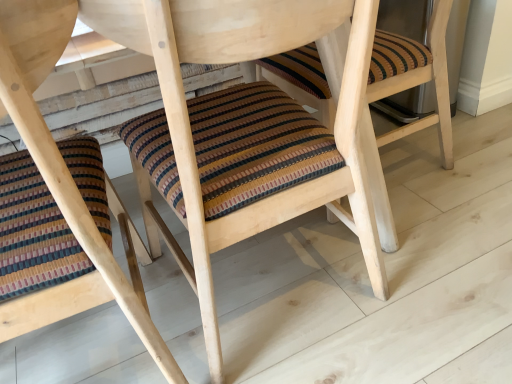
The height and width of the screenshot is (384, 512). I want to click on striped fabric cushion at center, the 2th chair when ordered from left to right, so click(x=246, y=127).

What do you see at coordinates (246, 127) in the screenshot?
I see `striped fabric cushion at center, which is counted as the 1th chair, starting from the right` at bounding box center [246, 127].

The image size is (512, 384). Find the location of `striped fabric cushion at lower left, acting as the 2th chair starting from the right`. striped fabric cushion at lower left, acting as the 2th chair starting from the right is located at coordinates 62,170.

Describe the element at coordinates (62, 170) in the screenshot. I see `striped fabric cushion at lower left, positioned as the 1th chair in left-to-right order` at that location.

How much space does striped fabric cushion at lower left, positioned as the 1th chair in left-to-right order, occupy vertically?

It is 33.05 inches.

The height and width of the screenshot is (384, 512). Identify the location of striped fabric cushion at center, the 2th chair when ordered from left to right. (246, 127).

Between striped fabric cushion at center, which is counted as the 1th chair, starting from the right, and striped fabric cushion at lower left, acting as the 2th chair starting from the right, which one appears on the right side from the viewer's perspective?

Positioned to the right is striped fabric cushion at center, which is counted as the 1th chair, starting from the right.

Is striped fabric cushion at center, which is counted as the 1th chair, starting from the right, positioned in front of striped fabric cushion at lower left, acting as the 2th chair starting from the right?

No, striped fabric cushion at center, which is counted as the 1th chair, starting from the right, is behind striped fabric cushion at lower left, acting as the 2th chair starting from the right.

Is point (290, 183) in front of point (163, 373)?

No, (290, 183) is further to viewer.

From the image's perspective, between striped fabric cushion at center, the 2th chair when ordered from left to right, and striped fabric cushion at lower left, acting as the 2th chair starting from the right, who is located below?

striped fabric cushion at lower left, acting as the 2th chair starting from the right, is shown below in the image.

From a real-world perspective, is striped fabric cushion at center, the 2th chair when ordered from left to right, positioned above or below striped fabric cushion at lower left, acting as the 2th chair starting from the right?

In terms of real-world spatial position, striped fabric cushion at center, the 2th chair when ordered from left to right, is below striped fabric cushion at lower left, acting as the 2th chair starting from the right.

In the scene shown: Considering the sizes of striped fabric cushion at center, which is counted as the 1th chair, starting from the right, and striped fabric cushion at lower left, positioned as the 1th chair in left-to-right order, in the image, is striped fabric cushion at center, which is counted as the 1th chair, starting from the right, wider or thinner than striped fabric cushion at lower left, positioned as the 1th chair in left-to-right order,?

striped fabric cushion at center, which is counted as the 1th chair, starting from the right, is thinner than striped fabric cushion at lower left, positioned as the 1th chair in left-to-right order.

Which of these two, striped fabric cushion at center, the 2th chair when ordered from left to right, or striped fabric cushion at lower left, acting as the 2th chair starting from the right, stands shorter?

striped fabric cushion at center, the 2th chair when ordered from left to right, is shorter.

Between striped fabric cushion at center, the 2th chair when ordered from left to right, and striped fabric cushion at lower left, positioned as the 1th chair in left-to-right order, which one has smaller size?

striped fabric cushion at lower left, positioned as the 1th chair in left-to-right order, is smaller.

Is striped fabric cushion at center, the 2th chair when ordered from left to right, not inside striped fabric cushion at lower left, acting as the 2th chair starting from the right?

Absolutely, striped fabric cushion at center, the 2th chair when ordered from left to right, is external to striped fabric cushion at lower left, acting as the 2th chair starting from the right.

Would you say striped fabric cushion at center, the 2th chair when ordered from left to right, is a long distance from striped fabric cushion at lower left, positioned as the 1th chair in left-to-right order?

No, striped fabric cushion at center, the 2th chair when ordered from left to right, is not far from striped fabric cushion at lower left, positioned as the 1th chair in left-to-right order.

In the scene shown: Is striped fabric cushion at center, which is counted as the 1th chair, starting from the right, oriented towards striped fabric cushion at lower left, positioned as the 1th chair in left-to-right order?

No.

Consider the image. How many degrees apart are the facing directions of striped fabric cushion at center, the 2th chair when ordered from left to right, and striped fabric cushion at lower left, acting as the 2th chair starting from the right?

The facing directions of striped fabric cushion at center, the 2th chair when ordered from left to right, and striped fabric cushion at lower left, acting as the 2th chair starting from the right, are 0.257 degrees apart.

How far apart are striped fabric cushion at center, which is counted as the 1th chair, starting from the right, and striped fabric cushion at lower left, acting as the 2th chair starting from the right?

striped fabric cushion at center, which is counted as the 1th chair, starting from the right, and striped fabric cushion at lower left, acting as the 2th chair starting from the right, are 11.99 inches apart from each other.

Identify the location of chair behind the striped fabric cushion at lower left, positioned as the 1th chair in left-to-right order. This screenshot has height=384, width=512. (246, 127).

Is striped fabric cushion at lower left, acting as the 2th chair starting from the right, to the left or to the right of striped fabric cushion at center, the 2th chair when ordered from left to right, in the image?

Clearly, striped fabric cushion at lower left, acting as the 2th chair starting from the right, is on the left of striped fabric cushion at center, the 2th chair when ordered from left to right, in the image.

Considering their positions, is striped fabric cushion at lower left, positioned as the 1th chair in left-to-right order, located in front of or behind striped fabric cushion at center, which is counted as the 1th chair, starting from the right?

In the image, striped fabric cushion at lower left, positioned as the 1th chair in left-to-right order, appears in front of striped fabric cushion at center, which is counted as the 1th chair, starting from the right.

Which is in front, point (52, 4) or point (303, 184)?

The point (52, 4) is in front.

From the image's perspective, would you say striped fabric cushion at lower left, acting as the 2th chair starting from the right, is shown under striped fabric cushion at center, the 2th chair when ordered from left to right?

Correct, striped fabric cushion at lower left, acting as the 2th chair starting from the right, appears lower than striped fabric cushion at center, the 2th chair when ordered from left to right, in the image.

From a real-world perspective, between striped fabric cushion at lower left, positioned as the 1th chair in left-to-right order, and striped fabric cushion at center, the 2th chair when ordered from left to right, who is vertically higher?

From a 3D spatial view, striped fabric cushion at lower left, positioned as the 1th chair in left-to-right order, is above.

Which object is wider, striped fabric cushion at lower left, positioned as the 1th chair in left-to-right order, or striped fabric cushion at center, which is counted as the 1th chair, starting from the right?

striped fabric cushion at lower left, positioned as the 1th chair in left-to-right order, is wider.

Considering the relative sizes of striped fabric cushion at lower left, acting as the 2th chair starting from the right, and striped fabric cushion at center, the 2th chair when ordered from left to right, in the image provided, is striped fabric cushion at lower left, acting as the 2th chair starting from the right, shorter than striped fabric cushion at center, the 2th chair when ordered from left to right,?

No.

From the picture: Which of these two, striped fabric cushion at lower left, acting as the 2th chair starting from the right, or striped fabric cushion at center, which is counted as the 1th chair, starting from the right, is smaller?

striped fabric cushion at lower left, acting as the 2th chair starting from the right.

In the scene shown: Is striped fabric cushion at lower left, positioned as the 1th chair in left-to-right order, outside of striped fabric cushion at center, the 2th chair when ordered from left to right?

Yes, striped fabric cushion at lower left, positioned as the 1th chair in left-to-right order, is located beyond the bounds of striped fabric cushion at center, the 2th chair when ordered from left to right.

Does striped fabric cushion at lower left, positioned as the 1th chair in left-to-right order, touch striped fabric cushion at center, the 2th chair when ordered from left to right?

No, striped fabric cushion at lower left, positioned as the 1th chair in left-to-right order, is not making contact with striped fabric cushion at center, the 2th chair when ordered from left to right.

Is striped fabric cushion at lower left, positioned as the 1th chair in left-to-right order, looking in the opposite direction of striped fabric cushion at center, which is counted as the 1th chair, starting from the right?

No, striped fabric cushion at lower left, positioned as the 1th chair in left-to-right order,'s orientation is not away from striped fabric cushion at center, which is counted as the 1th chair, starting from the right.

Measure the distance from striped fabric cushion at lower left, acting as the 2th chair starting from the right, to striped fabric cushion at center, which is counted as the 1th chair, starting from the right.

striped fabric cushion at lower left, acting as the 2th chair starting from the right, and striped fabric cushion at center, which is counted as the 1th chair, starting from the right, are 11.99 inches apart.

The height and width of the screenshot is (384, 512). There is a striped fabric cushion at center, the 2th chair when ordered from left to right. Identify the location of chair above it (from a real-world perspective). point(62,170).

Where is `chair located in front of the striped fabric cushion at center, the 2th chair when ordered from left to right`? This screenshot has height=384, width=512. chair located in front of the striped fabric cushion at center, the 2th chair when ordered from left to right is located at coordinates (62, 170).

Where is `chair that is on the left side of striped fabric cushion at center, which is counted as the 1th chair, starting from the right`? The image size is (512, 384). chair that is on the left side of striped fabric cushion at center, which is counted as the 1th chair, starting from the right is located at coordinates (62, 170).